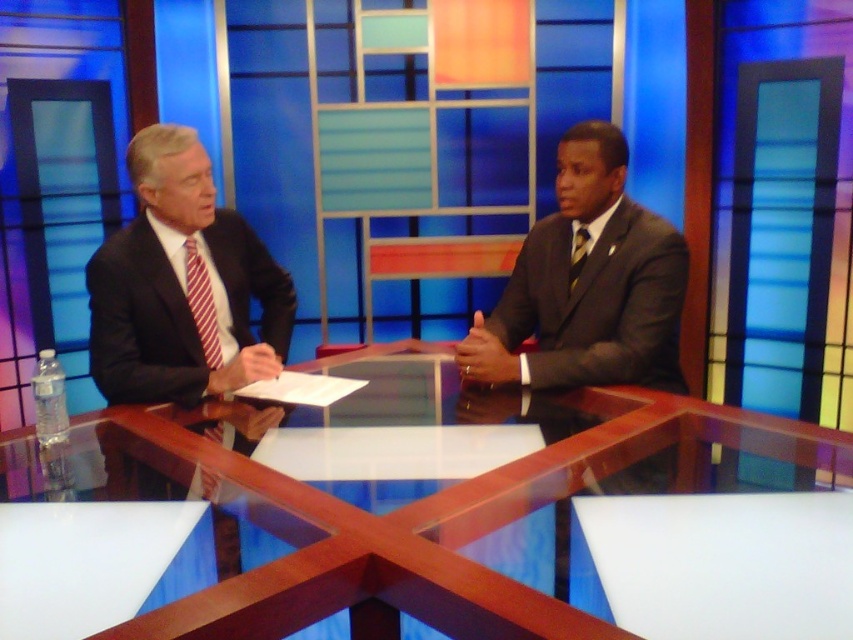
Question: Which of the following is the farthest from the observer?

Choices:
 (A) red striped tie at left
 (B) matte black suit at left
 (C) matte black suit at right

Answer: (A)

Question: Does matte black suit at right appear over red striped tie at left?

Choices:
 (A) yes
 (B) no

Answer: (A)

Question: Does matte black suit at left appear on the left side of red striped tie at left?

Choices:
 (A) yes
 (B) no

Answer: (B)

Question: Estimate the real-world distances between objects in this image. Which object is farther from the matte black suit at left?

Choices:
 (A) wooden glossy table at center
 (B) red striped tie at left
 (C) matte black suit at right
 (D) striped silk tie at right

Answer: (D)

Question: Is red striped tie at left further to camera compared to striped silk tie at right?

Choices:
 (A) no
 (B) yes

Answer: (A)

Question: Estimate the real-world distances between objects in this image. Which object is farther from the matte black suit at right?

Choices:
 (A) wooden glossy table at center
 (B) striped silk tie at right
 (C) red striped tie at left

Answer: (C)